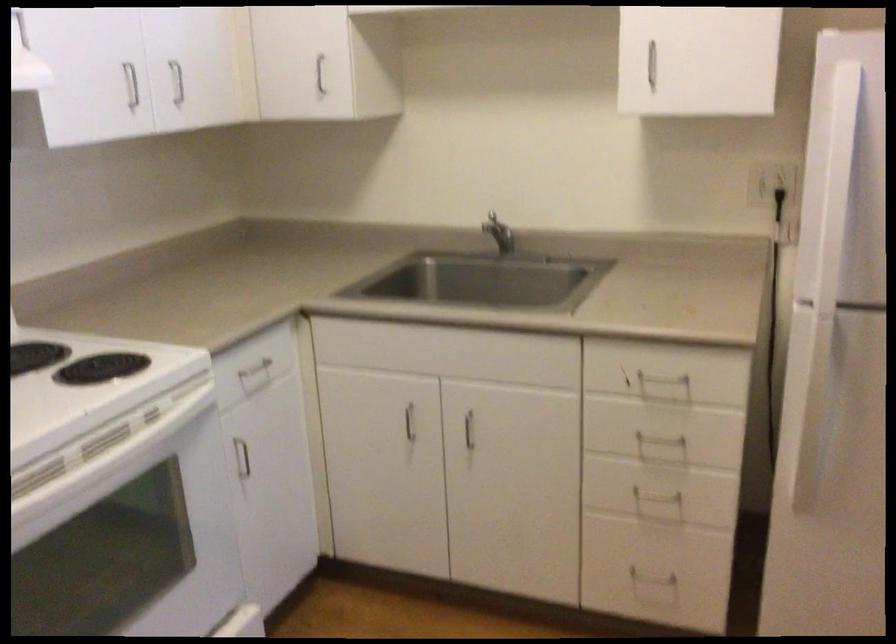
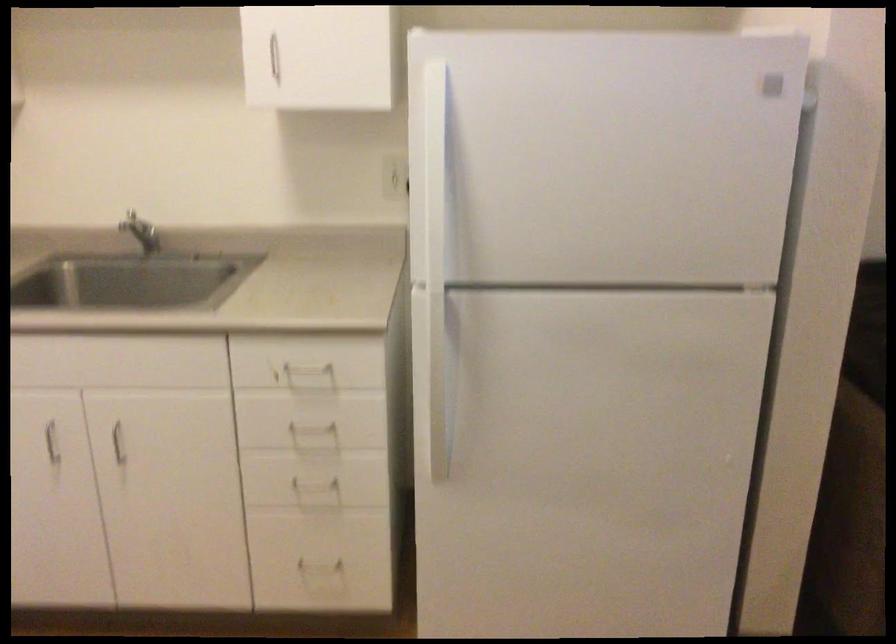
Where in the second image is the point corresponding to point (661, 381) from the first image?

(307, 368)